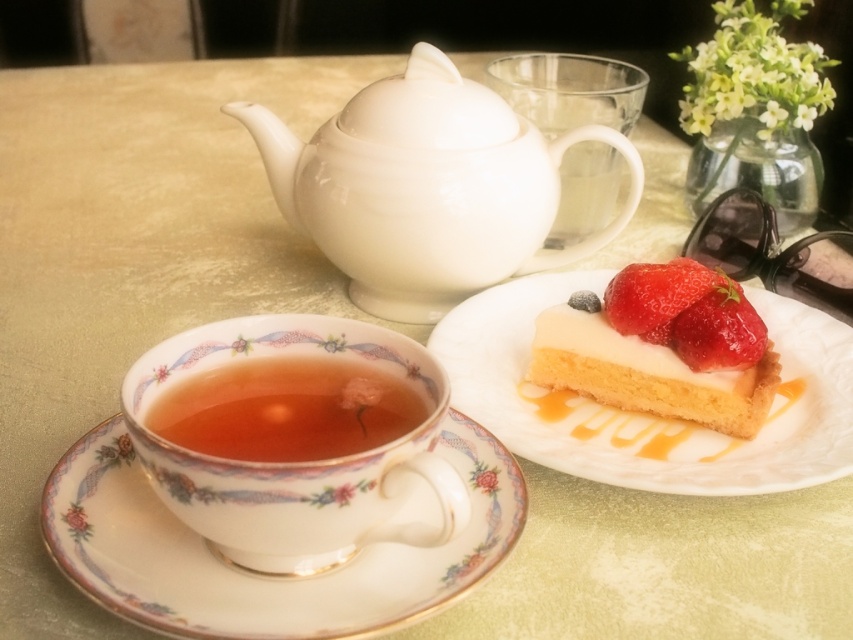
Question: Which point appears farthest from the camera in this image?

Choices:
 (A) (440, 576)
 (B) (679, 266)
 (C) (460, 196)

Answer: (C)

Question: Is porcelain saucer at lower left smaller than shiny red strawberry at right?

Choices:
 (A) yes
 (B) no

Answer: (B)

Question: Observing the image, what is the correct spatial positioning of translucent glass cup at center in reference to smooth cream cake with strawberries at right?

Choices:
 (A) left
 (B) right

Answer: (A)

Question: Estimate the real-world distances between objects in this image. Which object is closer to the shiny red strawberry at right?

Choices:
 (A) white glossy teapot at upper center
 (B) porcelain cup at lower left

Answer: (A)

Question: Which point appears farthest from the camera in this image?

Choices:
 (A) (712, 323)
 (B) (775, 385)
 (C) (641, 458)

Answer: (B)

Question: In this image, where is smooth cream cake with strawberries at right located relative to shiny red strawberry at upper right?

Choices:
 (A) above
 (B) below

Answer: (B)